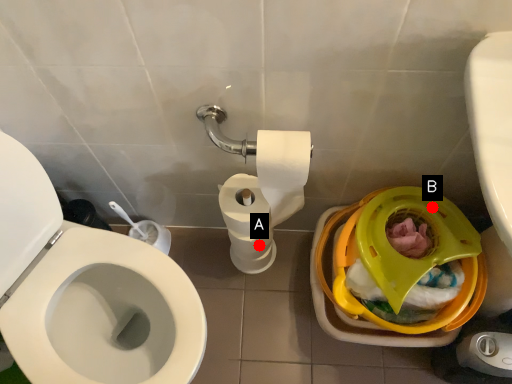
Question: Two points are circled on the image, labeled by A and B beside each circle. Which point is further to the camera?

Choices:
 (A) A is further
 (B) B is further

Answer: (A)